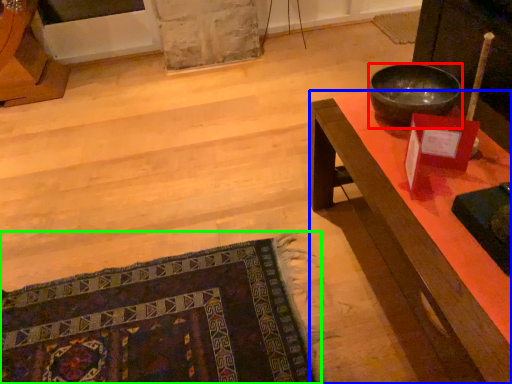
Question: Based on their relative distances, which object is nearer to bowl (highlighted by a red box)? Choose from desk (highlighted by a blue box) and mat (highlighted by a green box).

Choices:
 (A) desk
 (B) mat

Answer: (A)